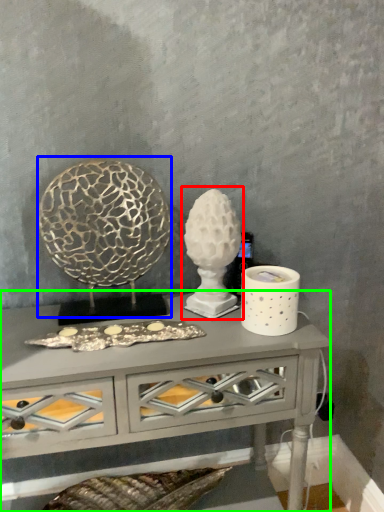
Question: Which object is the closest to the sculpture (highlighted by a red box)? Choose among these: sculpture (highlighted by a blue box) or table (highlighted by a green box).

Choices:
 (A) sculpture
 (B) table

Answer: (A)